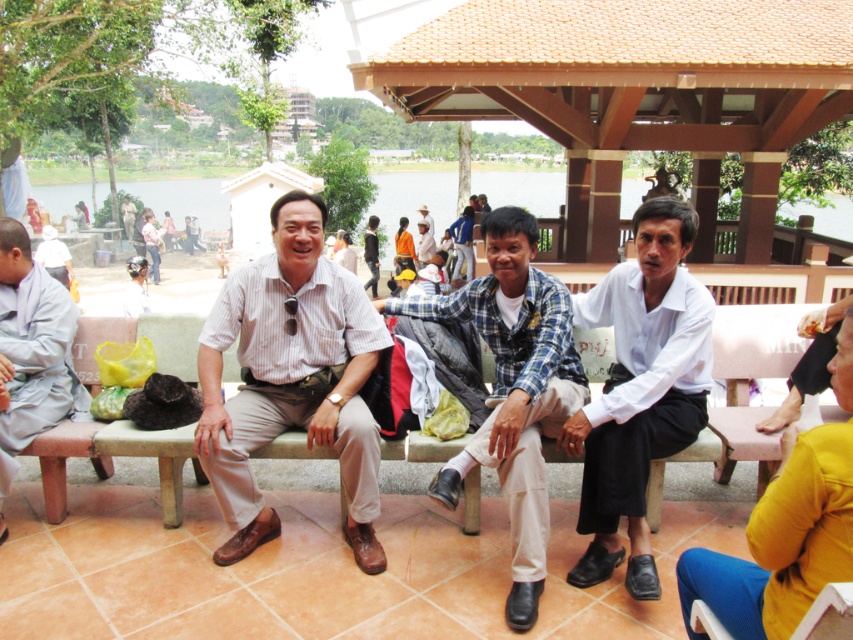
Who is shorter, white cotton shirt at center or light gray monk robe at left?

light gray monk robe at left is shorter.

In the scene shown: Is the position of white cotton shirt at center more distant than that of light gray monk robe at left?

No.

Is point (602, 488) positioned in front of point (41, 273)?

Yes, it is in front of point (41, 273).

At what (x,y) coordinates should I click in order to perform the action: click on white cotton shirt at center. Please return your answer as a coordinate pair (x, y). The image size is (853, 640). Looking at the image, I should click on coord(640,390).

Does white striped shirt at center come behind light gray monk robe at left?

No, it is in front of light gray monk robe at left.

Who is positioned more to the left, white striped shirt at center or light gray monk robe at left?

Positioned to the left is light gray monk robe at left.

Does point (322, 380) lie in front of point (39, 269)?

Yes, point (322, 380) is in front of point (39, 269).

You are a GUI agent. You are given a task and a screenshot of the screen. Output one action in this format:
    pyautogui.click(x=<x>, y=<y>)
    Task: Click on the white striped shirt at center
    
    Given the screenshot: What is the action you would take?
    pyautogui.click(x=291, y=378)

Does white striped shirt at center come in front of blue plaid shirt at center?

No, white striped shirt at center is further to the viewer.

Between white striped shirt at center and blue plaid shirt at center, which one has more height?

With more height is blue plaid shirt at center.

Measure the distance between point (264, 348) and camera.

A distance of 3.77 meters exists between point (264, 348) and camera.

Identify the location of white striped shirt at center. (291, 378).